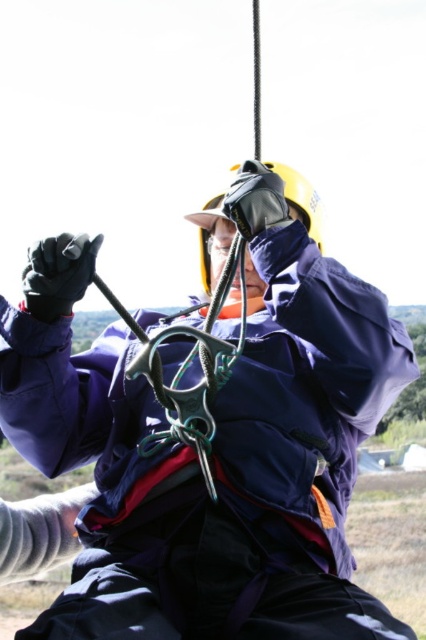
You are a safety inspector checking the equipment setup for a ropes course. You notice the navy blue jacket at center and the yellow matte helmet at center. Which piece of equipment takes up more space in the setup?

The navy blue jacket at center is larger in size than the yellow matte helmet at center, so the navy blue jacket at center takes up more space in the setup.

You are a safety inspector checking the setup of the ropes course participant. Based on the image, is the navy blue jacket at center positioned above or below the yellow matte helmet at center?

The navy blue jacket at center is below the yellow matte helmet at center according to the description.

You are a safety inspector checking the setup of the ropes course. You notice the navy blue jacket at center and the yellow matte helmet at center. Which item is taller when viewed from the front?

The navy blue jacket at center is taller than the yellow matte helmet at center.